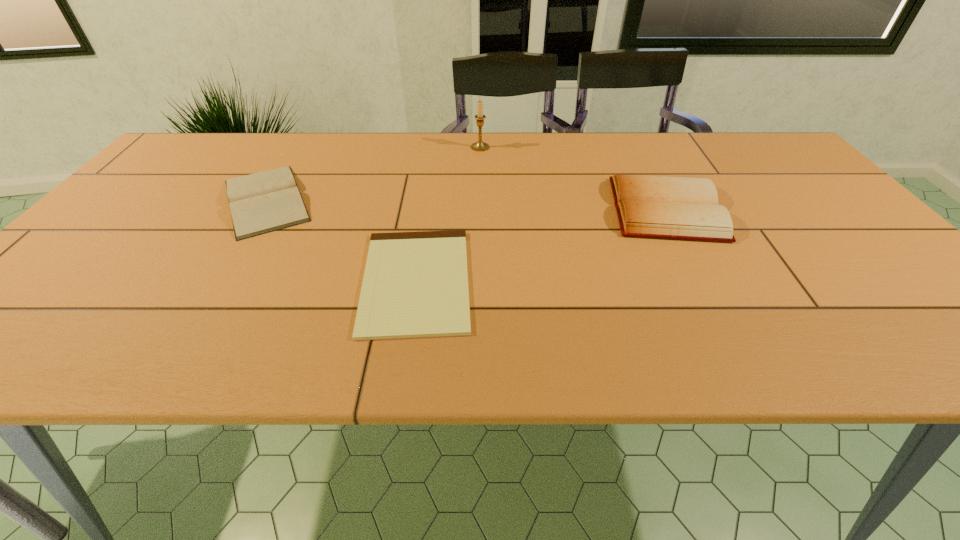
Point out which object is positioned as the second nearest to the clipboard. Please provide its 2D coordinates. Your answer should be formatted as a tuple, i.e. [(x, y)], where the tuple contains the x and y coordinates of a point satisfying the conditions above.

[(683, 208)]

Find the location of `vacant area in the image that satisfies the following two spatial constraints: 1. on the front side of the right Bible; 2. on the left side of the tallest object`. vacant area in the image that satisfies the following two spatial constraints: 1. on the front side of the right Bible; 2. on the left side of the tallest object is located at coordinates (480, 209).